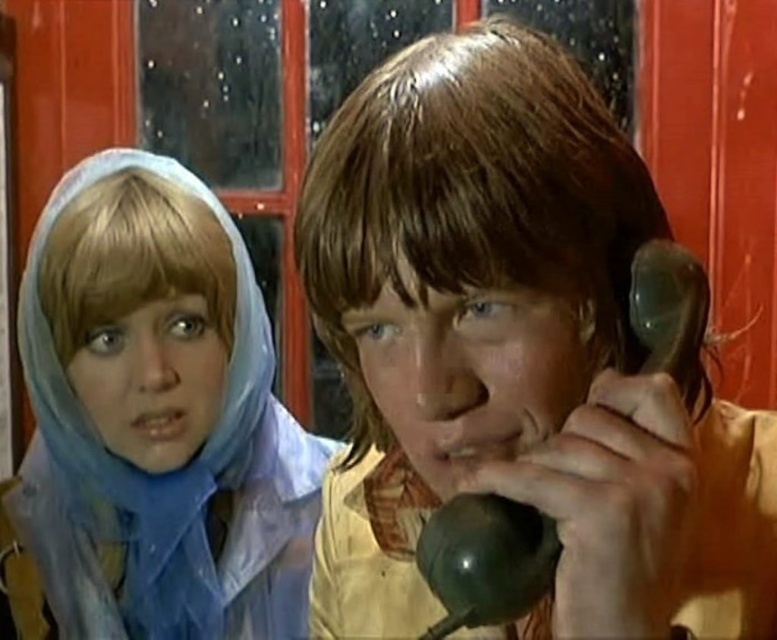
Is shiny brown hair at center smaller than blue sheer headscarf at upper left?

No, shiny brown hair at center is not smaller than blue sheer headscarf at upper left.

Between point (702, 400) and point (235, 532), which one is positioned behind?

Positioned behind is point (235, 532).

What do you see at coordinates (514, 355) in the screenshot? I see `shiny brown hair at center` at bounding box center [514, 355].

Find the location of a particular element. shiny brown hair at center is located at coordinates (514, 355).